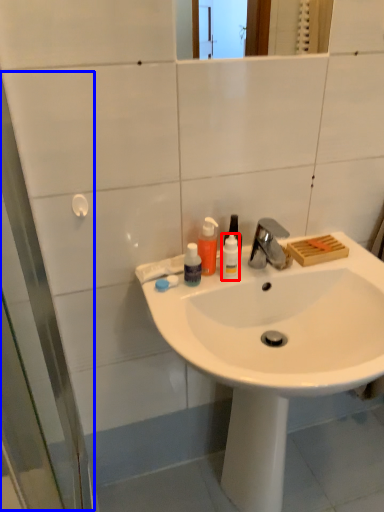
Question: Which object appears farthest to the camera in this image, bottle (highlighted by a red box) or screen door (highlighted by a blue box)?

Choices:
 (A) bottle
 (B) screen door

Answer: (A)